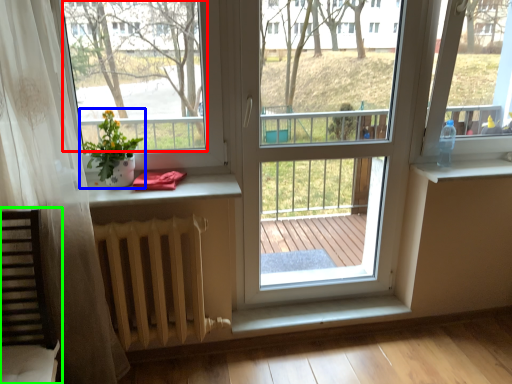
Question: Which object is positioned farthest from window screen (highlighted by a red box)? Select from houseplant (highlighted by a blue box) and rocking chair (highlighted by a green box).

Choices:
 (A) houseplant
 (B) rocking chair

Answer: (B)